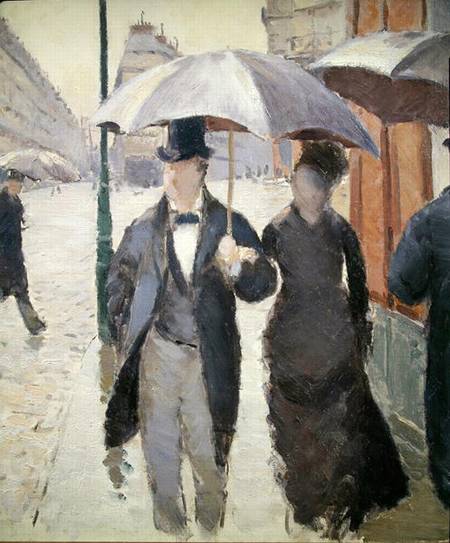
The width and height of the screenshot is (450, 543). In order to click on top of a painting in this screenshot , I will do `click(206, 33)`.